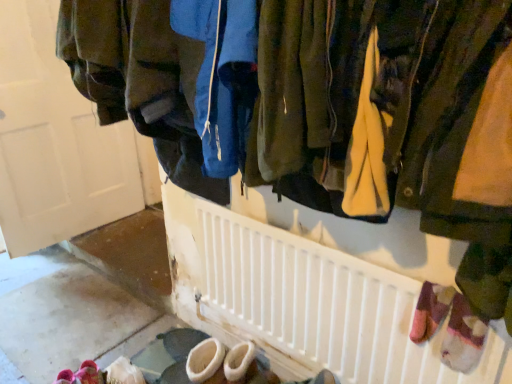
Question: From a real-world perspective, is pink fuzzy slippers at lower left located higher than white plastic radiator at center?

Choices:
 (A) yes
 (B) no

Answer: (B)

Question: Considering the relative sizes of pink fuzzy slippers at lower left and white plastic radiator at center in the image provided, is pink fuzzy slippers at lower left wider than white plastic radiator at center?

Choices:
 (A) no
 (B) yes

Answer: (B)

Question: Is pink fuzzy slippers at lower left positioned with its back to white plastic radiator at center?

Choices:
 (A) no
 (B) yes

Answer: (A)

Question: Does pink fuzzy slippers at lower left come in front of white plastic radiator at center?

Choices:
 (A) yes
 (B) no

Answer: (B)

Question: Is pink fuzzy slippers at lower left directly adjacent to white plastic radiator at center?

Choices:
 (A) yes
 (B) no

Answer: (B)

Question: From a real-world perspective, is pink fuzzy slippers at lower left positioned under white plastic radiator at center based on gravity?

Choices:
 (A) no
 (B) yes

Answer: (B)

Question: Are white plastic radiator at center and pink fuzzy slippers at lower left located far from each other?

Choices:
 (A) yes
 (B) no

Answer: (B)

Question: From the image's perspective, is white plastic radiator at center located above pink fuzzy slippers at lower left?

Choices:
 (A) yes
 (B) no

Answer: (A)

Question: Can you confirm if white plastic radiator at center is bigger than pink fuzzy slippers at lower left?

Choices:
 (A) no
 (B) yes

Answer: (B)

Question: Is white plastic radiator at center further to camera compared to pink fuzzy slippers at lower left?

Choices:
 (A) no
 (B) yes

Answer: (A)

Question: Is the surface of white plastic radiator at center in direct contact with pink fuzzy slippers at lower left?

Choices:
 (A) no
 (B) yes

Answer: (A)

Question: Is white plastic radiator at center facing towards pink fuzzy slippers at lower left?

Choices:
 (A) yes
 (B) no

Answer: (A)

Question: Is the position of matte white door at upper left less distant than that of pink fuzzy slippers at lower left?

Choices:
 (A) yes
 (B) no

Answer: (B)